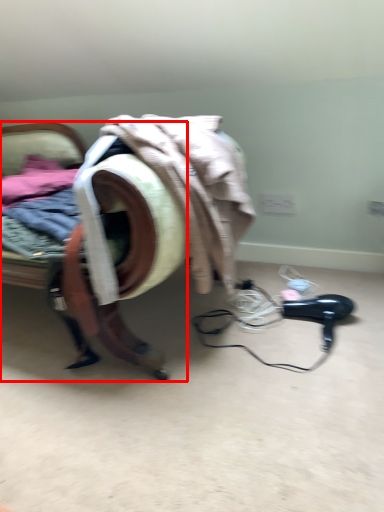
Question: From the image's perspective, considering the relative positions of furniture (annotated by the red box) and hair drier in the image provided, where is furniture (annotated by the red box) located with respect to the staircase?

Choices:
 (A) below
 (B) above

Answer: (B)